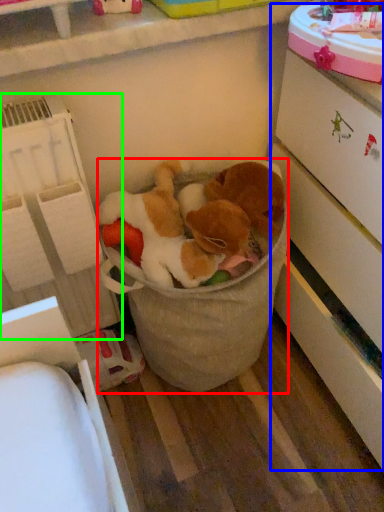
Question: Which object is the closest to the toy (highlighted by a red box)? Choose among these: cabinetry (highlighted by a blue box) or shelf (highlighted by a green box).

Choices:
 (A) cabinetry
 (B) shelf

Answer: (B)